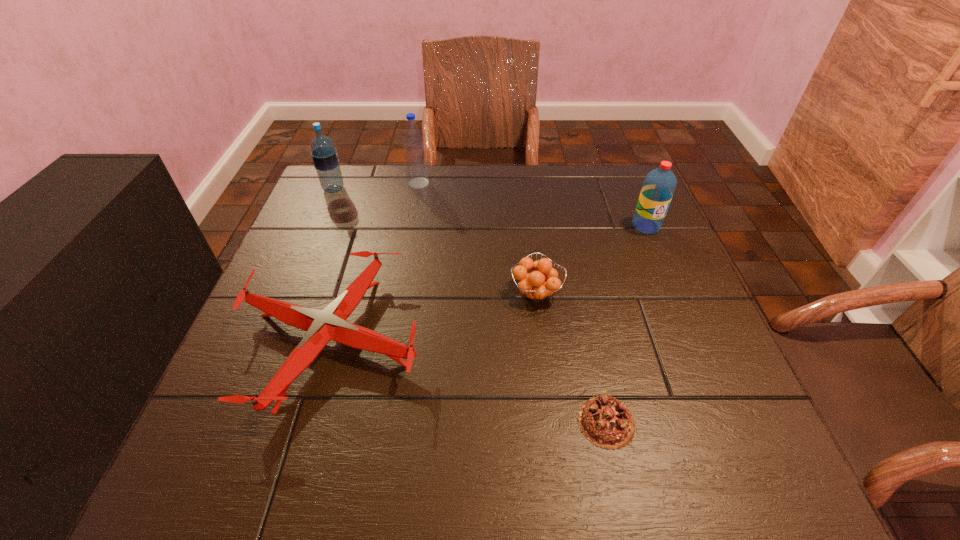
Locate an element on the screen. the second water bottle from right to left is located at coordinates (415, 159).

Find the location of a particular element. This screenshot has height=540, width=960. the leftmost water bottle is located at coordinates (x=324, y=155).

You are a GUI agent. You are given a task and a screenshot of the screen. Output one action in this format:
    pyautogui.click(x=<x>, y=<y>)
    Task: Click on the rightmost object
    The image size is (960, 540).
    Given the screenshot: What is the action you would take?
    pyautogui.click(x=659, y=185)

Where is `the rightmost water bottle`? the rightmost water bottle is located at coordinates (659, 185).

I want to click on orange fruit, so click(x=533, y=285).

At what (x,y) coordinates should I click in order to perform the action: click on drone. Please return your answer as a coordinate pair (x, y). This screenshot has width=960, height=540. Looking at the image, I should click on (330, 323).

I want to click on chocolate cake, so click(604, 420).

At what (x,y) coordinates should I click in order to perform the action: click on vacant space situated on the front of the second water bottle from left to right. Please return your answer as a coordinate pair (x, y). The width and height of the screenshot is (960, 540). Looking at the image, I should click on (416, 199).

I want to click on vacant area located on the front of the leftmost water bottle, so click(324, 213).

This screenshot has width=960, height=540. What are the coordinates of `vacant area situated 0.230m on the front label of the third farthest object` in the screenshot? It's located at (679, 303).